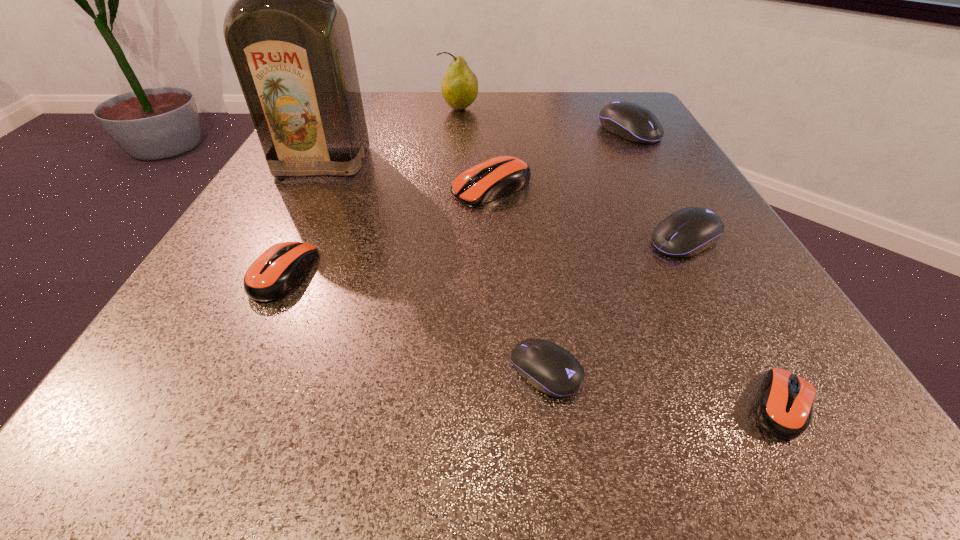
Point out which orange computer mouse is positioned as the nearest to the liquor. Please provide its 2D coordinates. Your answer should be formatted as a tuple, i.e. [(x, y)], where the tuple contains the x and y coordinates of a point satisfying the conditions above.

[(496, 177)]

This screenshot has height=540, width=960. What are the coordinates of `free space that satisfies the following two spatial constraints: 1. on the front side of the leftmost black computer mouse; 2. on the left side of the leftmost computer mouse` in the screenshot? It's located at (237, 371).